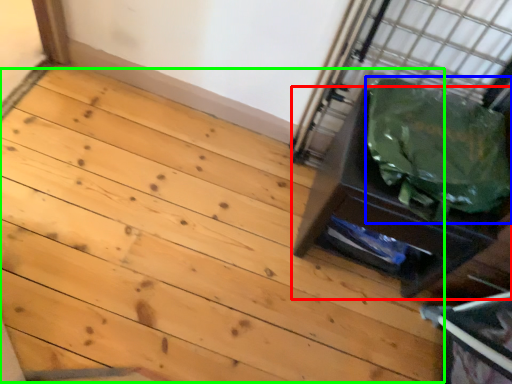
Question: Based on their relative distances, which object is farther from furniture (highlighted by a red box)? Choose from garbage (highlighted by a blue box) and stairwell (highlighted by a green box).

Choices:
 (A) garbage
 (B) stairwell

Answer: (B)